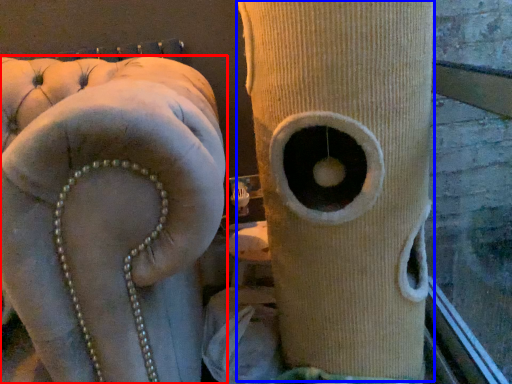
Question: Which of the following is the closest to the observer, furniture (highlighted by a red box) or tree trunk (highlighted by a blue box)?

Choices:
 (A) furniture
 (B) tree trunk

Answer: (A)